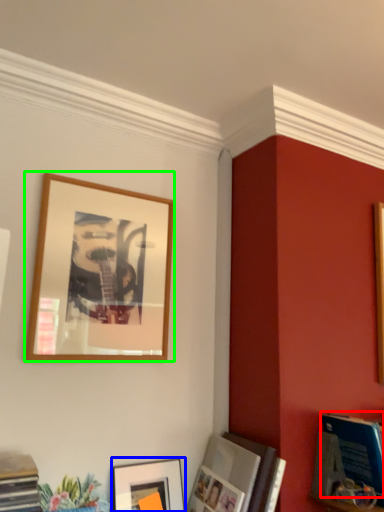
Question: Which object is the closest to the magazine (highlighted by a red box)? Choose among these: picture frame (highlighted by a blue box) or picture frame (highlighted by a green box).

Choices:
 (A) picture frame
 (B) picture frame

Answer: (A)